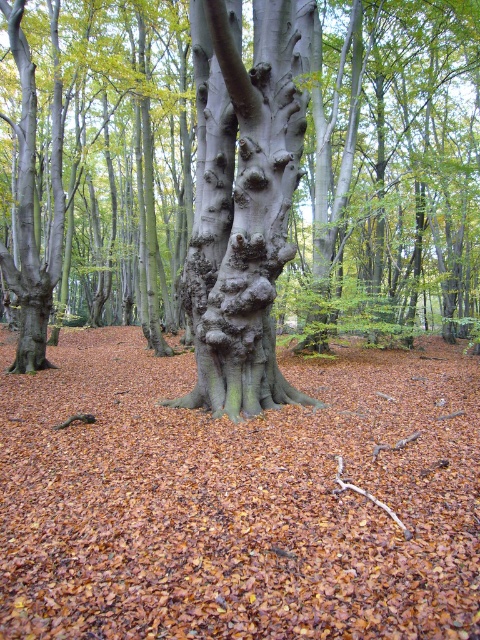
You are a hiker standing in the middle of the forest and see the brown matte tree trunk at center and the smooth gray tree trunk at center. Which tree trunk is located to the right of the other?

The brown matte tree trunk at center is positioned on the right side of smooth gray tree trunk at center, so the brown matte tree trunk at center is to the right of the smooth gray tree trunk at center.

You are a hiker trying to identify landmarks in the forest. You notice two features at the center of the image. Which one is bigger between the brown matte tree trunk at center and the smooth gray bark at center?

The brown matte tree trunk at center has a larger size compared to the smooth gray bark at center, so the brown matte tree trunk at center is bigger.